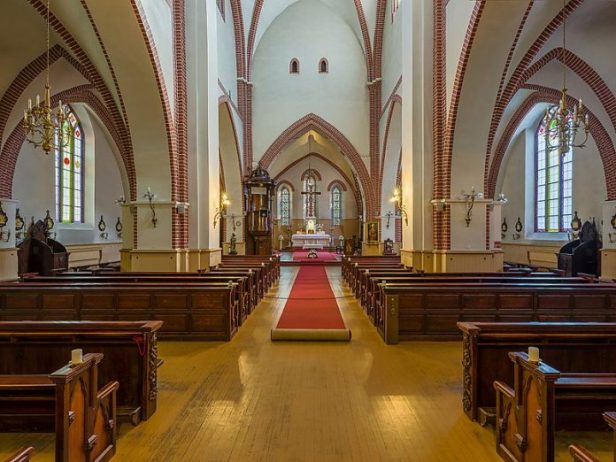
This screenshot has height=462, width=616. I want to click on side adornments, so click(100, 223).